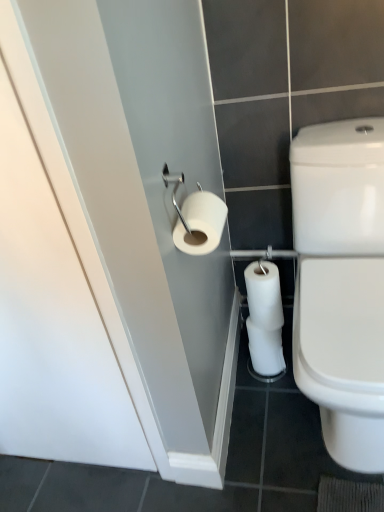
Identify the location of white matte toilet paper at center. (200, 223).

The width and height of the screenshot is (384, 512). What do you see at coordinates (200, 223) in the screenshot? I see `white matte toilet paper at center` at bounding box center [200, 223].

At what (x,y) coordinates should I click in order to perform the action: click on white matte toilet paper at center. Please return your answer as a coordinate pair (x, y). Image resolution: width=384 pixels, height=512 pixels. Looking at the image, I should click on (200, 223).